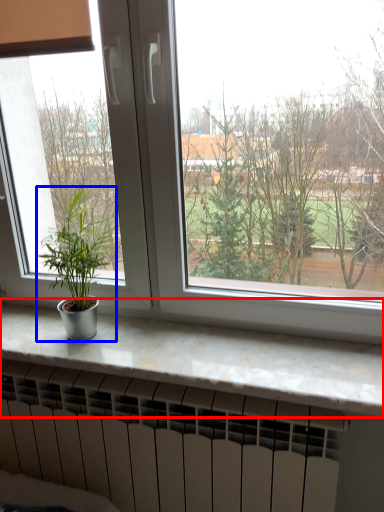
Question: Which object appears closest to the camera in this image, counter top (highlighted by a red box) or houseplant (highlighted by a blue box)?

Choices:
 (A) counter top
 (B) houseplant

Answer: (A)